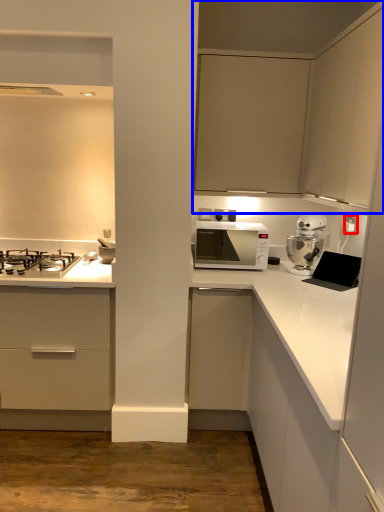
Question: Which object is further to the camera taking this photo, electric outlet (highlighted by a red box) or cabinetry (highlighted by a blue box)?

Choices:
 (A) electric outlet
 (B) cabinetry

Answer: (A)